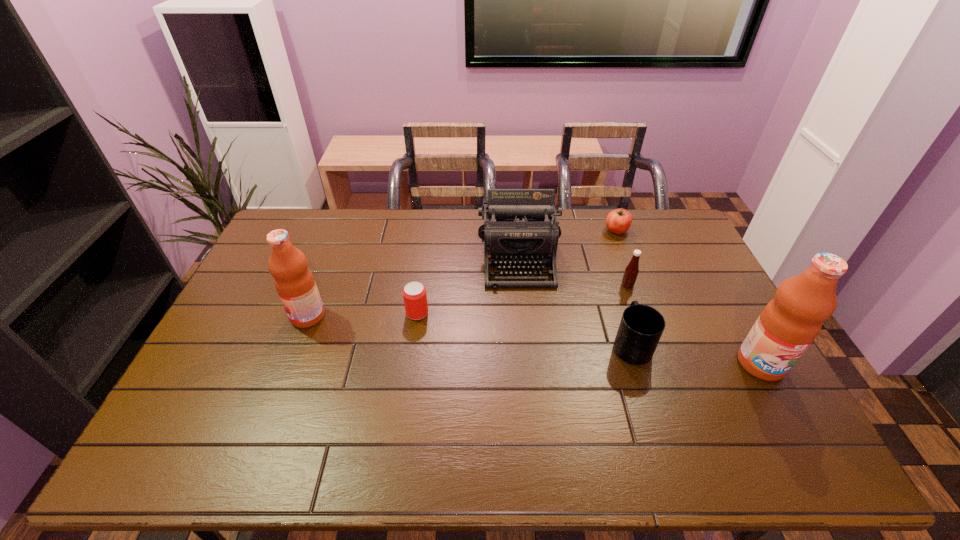
If we want them evenly spaced by inserting an extra fruit_juice among them, please locate a free spot for this new fruit_juice. Please provide its 2D coordinates. Your answer should be formatted as a tuple, i.e. [(x, y)], where the tuple contains the x and y coordinates of a point satisfying the conditions above.

[(523, 339)]